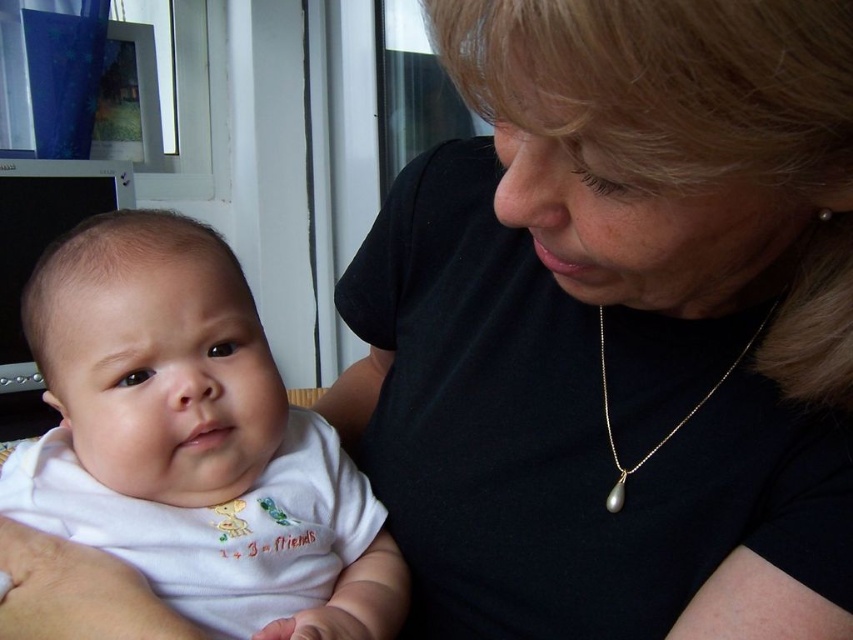
You are a fashion designer analyzing this image. You need to determine which item is taller between the black matte shirt at center and the gold pearl necklace at lower center. Which one is taller?

The black matte shirt at center has a greater height compared to the gold pearl necklace at lower center, so the black matte shirt at center is taller.